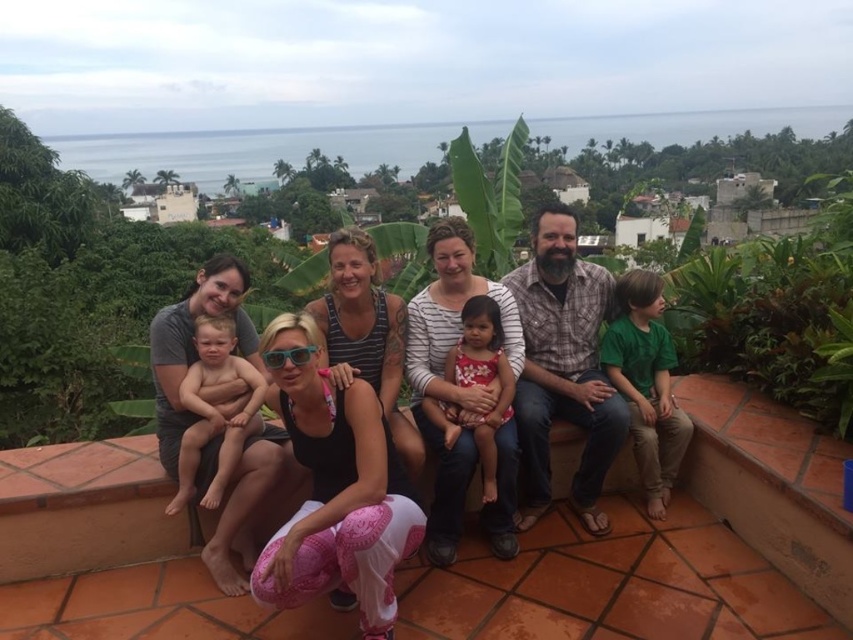
In the scene shown: Does matte black tank top at center have a larger size compared to green cotton shirt at right?

Indeed, matte black tank top at center has a larger size compared to green cotton shirt at right.

This screenshot has width=853, height=640. What do you see at coordinates (518, 387) in the screenshot?
I see `matte black tank top at center` at bounding box center [518, 387].

The image size is (853, 640). In order to click on matte black tank top at center in this screenshot , I will do `click(518, 387)`.

Is pink crochet pants at center smaller than green cotton shirt at right?

Correct, pink crochet pants at center occupies less space than green cotton shirt at right.

Is pink crochet pants at center thinner than green cotton shirt at right?

Yes, pink crochet pants at center is thinner than green cotton shirt at right.

Is point (282, 589) positioned behind point (654, 403)?

No, it is in front of (654, 403).

At what (x,y) coordinates should I click in order to perform the action: click on pink crochet pants at center. Please return your answer as a coordinate pair (x, y). This screenshot has width=853, height=640. Looking at the image, I should click on (335, 486).

Between matte black tank top at center and smooth skin baby at center, which one appears on the left side from the viewer's perspective?

From the viewer's perspective, smooth skin baby at center appears more on the left side.

Is point (596, 426) positioned before point (215, 426)?

No, it is not.

Identify the location of matte black tank top at center. The image size is (853, 640). (518, 387).